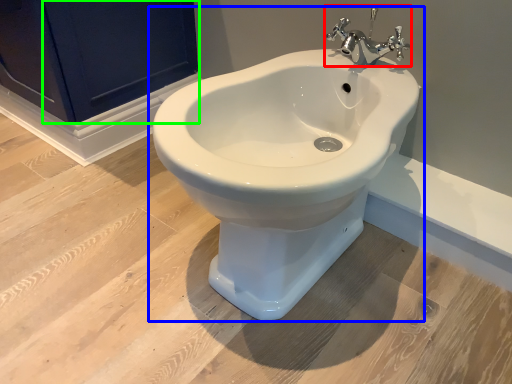
Question: Which object is positioned farthest from tap (highlighted by a red box)? Select from toilet (highlighted by a blue box) and screen door (highlighted by a green box).

Choices:
 (A) toilet
 (B) screen door

Answer: (B)